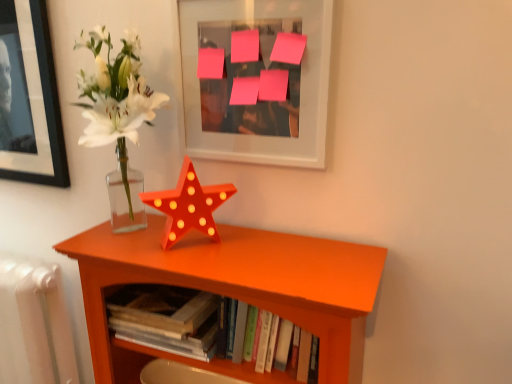
Find the location of `white plastic radiator at lower left`. white plastic radiator at lower left is located at coordinates (34, 323).

Where is `pink paper at upper center`? The image size is (512, 384). pink paper at upper center is located at coordinates (256, 79).

In order to face pink paper at upper center, should I rotate leftwards or rightwards?

To align with it, rotate left about 0.925°.

Image resolution: width=512 pixels, height=384 pixels. Find the location of `orange wood shelf at center`. orange wood shelf at center is located at coordinates pos(234,290).

Is hardcover books at center outside of orange wood shelf at center?

No.

Can you tell me how much hardcover books at center and orange wood shelf at center differ in facing direction?

They differ by 3.08e-06 degrees in their facing directions.

Considering the sizes of hardcover books at center and orange wood shelf at center in the image, is hardcover books at center bigger or smaller than orange wood shelf at center?

Clearly, hardcover books at center is smaller in size than orange wood shelf at center.

Which is behind, point (126, 307) or point (320, 349)?

Point (126, 307)

Locate an element on the screen. The image size is (512, 384). radiator beneath the pink paper at upper center (from a real-world perspective) is located at coordinates (x=34, y=323).

How many degrees apart are the facing directions of pink paper at upper center and white plastic radiator at lower left?

The angular difference between pink paper at upper center and white plastic radiator at lower left is 1.34 degrees.

Is white plastic radiator at lower left surrounded by pink paper at upper center?

Actually, white plastic radiator at lower left is outside pink paper at upper center.

Could you tell me if pink paper at upper center is facing white plastic radiator at lower left?

A: No, pink paper at upper center is not turned towards white plastic radiator at lower left.

Does pink paper at upper center have a greater width compared to matte glass vase at center left?

No, pink paper at upper center is not wider than matte glass vase at center left.

Which of these two, pink paper at upper center or matte glass vase at center left, is bigger?

pink paper at upper center is bigger.

Could you tell me if pink paper at upper center is facing matte glass vase at center left?

No, pink paper at upper center is not oriented towards matte glass vase at center left.

Which is closer to the camera, (288, 101) or (217, 188)?

Point (288, 101) is closer to the camera than point (217, 188).

Is white plastic radiator at lower left looking in the opposite direction of hardcover books at center?

No, white plastic radiator at lower left is not facing the opposite direction of hardcover books at center.

How many degrees apart are the facing directions of white plastic radiator at lower left and hardcover books at center?

white plastic radiator at lower left and hardcover books at center are facing 1.34 degrees away from each other.

Does point (50, 359) come in front of point (118, 336)?

No, it is not.

Can orange wood shelf at center be found inside white plastic radiator at lower left?

No, orange wood shelf at center is not surrounded by white plastic radiator at lower left.

Is there a large distance between white plastic radiator at lower left and orange wood shelf at center?

white plastic radiator at lower left is actually quite close to orange wood shelf at center.

Visually, is white plastic radiator at lower left positioned to the left or to the right of orange wood shelf at center?

In the image, white plastic radiator at lower left appears on the left side of orange wood shelf at center.

Which is in front, white plastic radiator at lower left or orange wood shelf at center?

Positioned in front is orange wood shelf at center.

From a real-world perspective, is matte glass vase at center left below orange wood shelf at center?

No.

Is matte glass vase at center left behind orange wood shelf at center?

Yes, it is behind orange wood shelf at center.

Is matte glass vase at center left oriented towards orange wood shelf at center?

No, matte glass vase at center left is not aimed at orange wood shelf at center.

From the image's perspective, which object appears higher, pink paper at upper center or orange wood shelf at center?

pink paper at upper center is shown above in the image.

Considering the points (306, 49) and (205, 246), which point is behind, point (306, 49) or point (205, 246)?

Point (205, 246)

Can you confirm if pink paper at upper center is smaller than orange wood shelf at center?

Correct, pink paper at upper center occupies less space than orange wood shelf at center.

Can you tell me how much pink paper at upper center and orange wood shelf at center differ in facing direction?

The angular difference between pink paper at upper center and orange wood shelf at center is 2.78e-05 degrees.

In order to click on shelf on the right of hardcover books at center in this screenshot , I will do `click(234, 290)`.

This screenshot has width=512, height=384. What are the coordinates of `picture frame located in front of the white plastic radiator at lower left` in the screenshot? It's located at (256, 79).

Which object lies nearer to the anchor point hardcover books at center, orange wood shelf at center or pink paper at upper center?

orange wood shelf at center is closer to hardcover books at center.

Considering their positions, is hardcover books at center positioned closer to orange wood shelf at center than white plastic radiator at lower left?

hardcover books at center lies closer to orange wood shelf at center than the other object.

Based on their spatial positions, is white plastic radiator at lower left or pink paper at upper center further from orange wood shelf at center?

white plastic radiator at lower left is positioned further to the anchor orange wood shelf at center.

When comparing their distances from matte glass vase at center left, does hardcover books at center or white plastic radiator at lower left seem further?

white plastic radiator at lower left lies further to matte glass vase at center left than the other object.

Which object lies further to the anchor point orange wood shelf at center, hardcover books at center or pink paper at upper center?

The object further to orange wood shelf at center is pink paper at upper center.

From the image, which object appears to be farther from white plastic radiator at lower left, pink paper at upper center or orange wood shelf at center?

The object further to white plastic radiator at lower left is pink paper at upper center.

Looking at the image, which one is located further to hardcover books at center, pink paper at upper center or matte glass vase at center left?

pink paper at upper center lies further to hardcover books at center than the other object.

Considering their positions, is white plastic radiator at lower left positioned closer to pink paper at upper center than matte glass vase at center left?

matte glass vase at center left is closer to pink paper at upper center.

Where is `book between matte glass vase at center left and orange wood shelf at center in the up-down direction`? book between matte glass vase at center left and orange wood shelf at center in the up-down direction is located at coordinates (165, 318).

This screenshot has height=384, width=512. What are the coordinates of `book between white plastic radiator at lower left and matte glass vase at center left from left to right` in the screenshot? It's located at (165, 318).

Locate an element on the screen. This screenshot has height=384, width=512. flower between white plastic radiator at lower left and orange wood shelf at center from left to right is located at coordinates (188, 205).

Find the location of `book between white plastic radiator at lower left and pink paper at upper center`. book between white plastic radiator at lower left and pink paper at upper center is located at coordinates (165, 318).